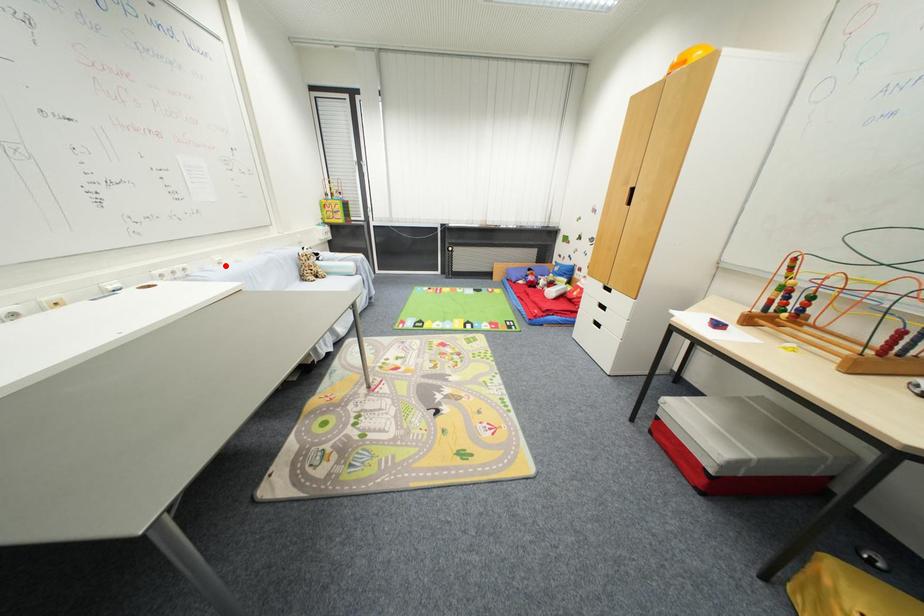
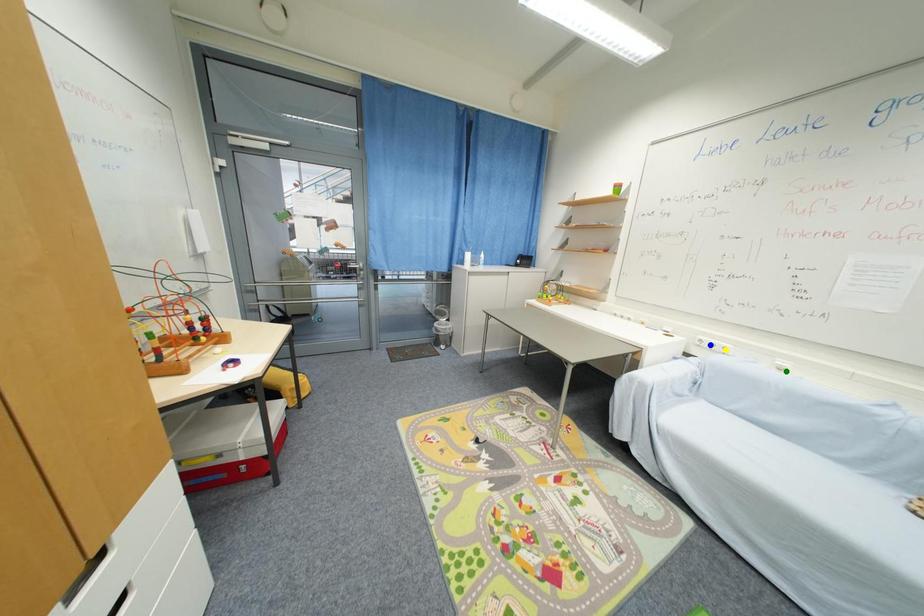
Question: I am providing you with two images of the same scene from different viewpoints. A red point is marked on the first image. You are given multiple points on the second image. Which point in image 2 represents the same 3d spot as the red point in image 1?

Choices:
 (A) green point
 (B) blue point
 (C) yellow point

Answer: (A)